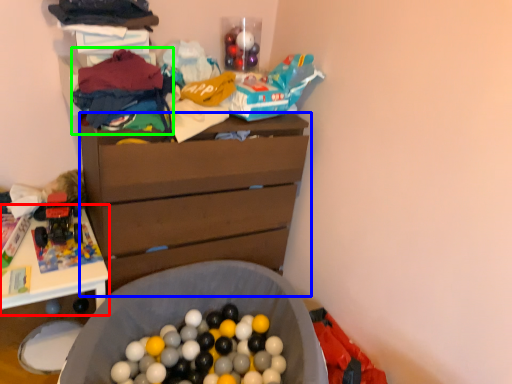
Question: Which is nearer to the table (highlighted by a red box)? chest of drawers (highlighted by a blue box) or clothing (highlighted by a green box).

Choices:
 (A) chest of drawers
 (B) clothing

Answer: (A)